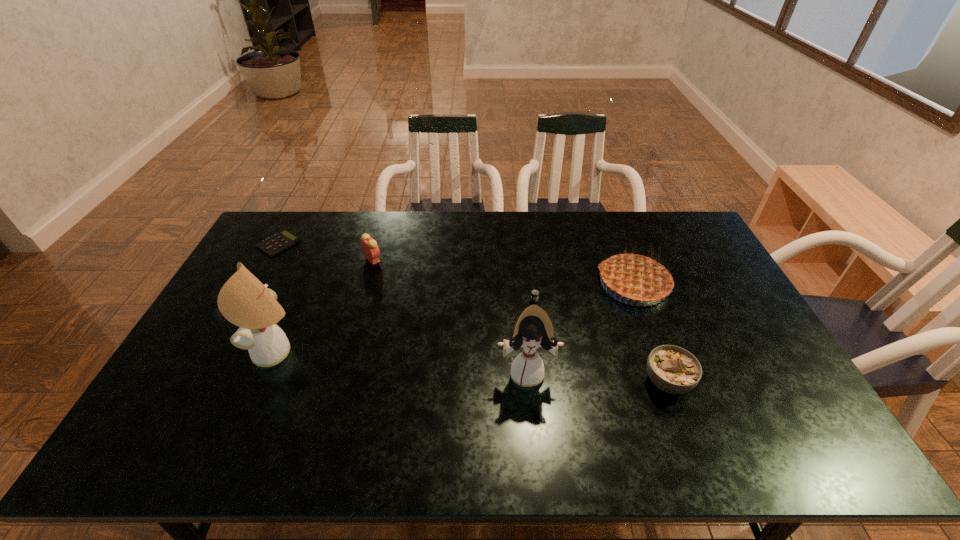
Where is `vacant space that satisfies the following two spatial constraints: 1. on the front side of the third shortest object; 2. on the right side of the beer can`? The width and height of the screenshot is (960, 540). vacant space that satisfies the following two spatial constraints: 1. on the front side of the third shortest object; 2. on the right side of the beer can is located at coordinates (544, 382).

I want to click on vacant area in the image that satisfies the following two spatial constraints: 1. at the front face of the second object from left to right; 2. on the back side of the soup bowl, so click(264, 382).

The image size is (960, 540). Find the location of `free space in the image that satisfies the following two spatial constraints: 1. on the face of the alarm clock; 2. on the right side of the pie`. free space in the image that satisfies the following two spatial constraints: 1. on the face of the alarm clock; 2. on the right side of the pie is located at coordinates (366, 284).

This screenshot has height=540, width=960. Identify the location of vacant point that satisfies the following two spatial constraints: 1. at the front face of the taller doll; 2. on the back side of the soup bowl. (264, 382).